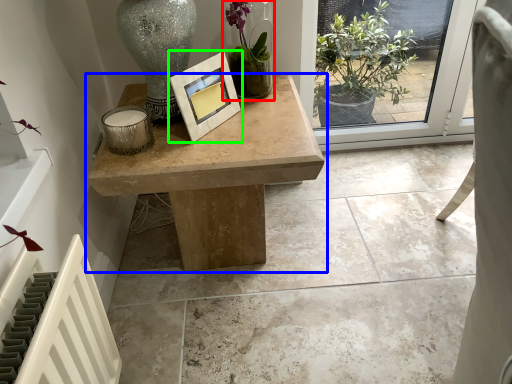
Question: Estimate the real-world distances between objects in this image. Which object is farther from houseplant (highlighted by a red box), table (highlighted by a blue box) or picture frame (highlighted by a green box)?

Choices:
 (A) table
 (B) picture frame

Answer: (A)